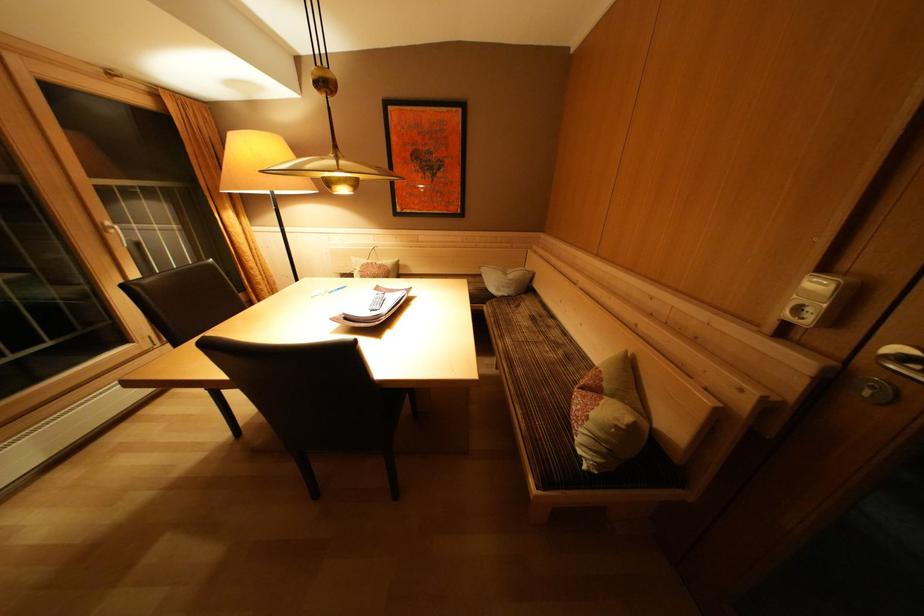
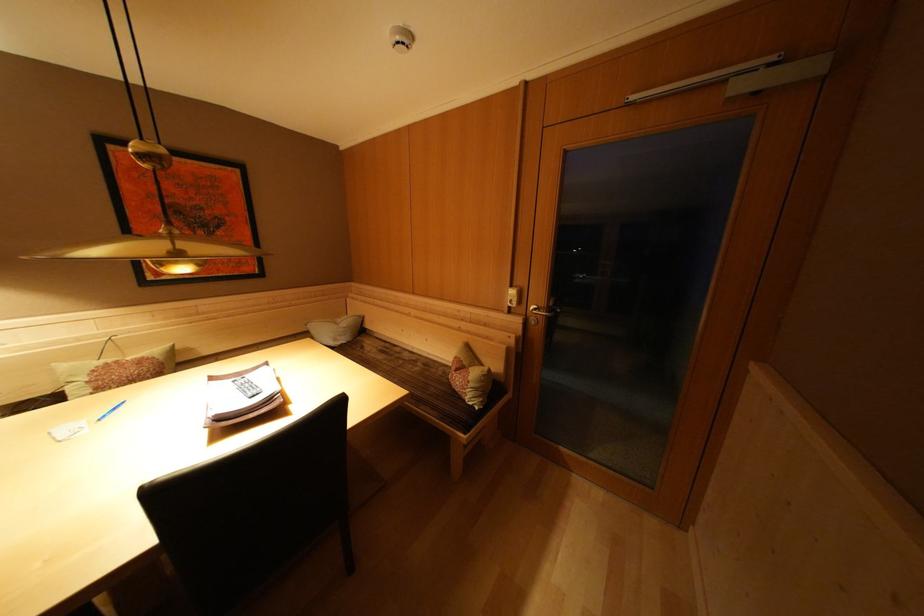
Question: Based on the continuous images, in which direction is the camera rotating? Reply with the corresponding letter.

Choices:
 (A) Left
 (B) Right
 (C) Up
 (D) Down

Answer: (B)